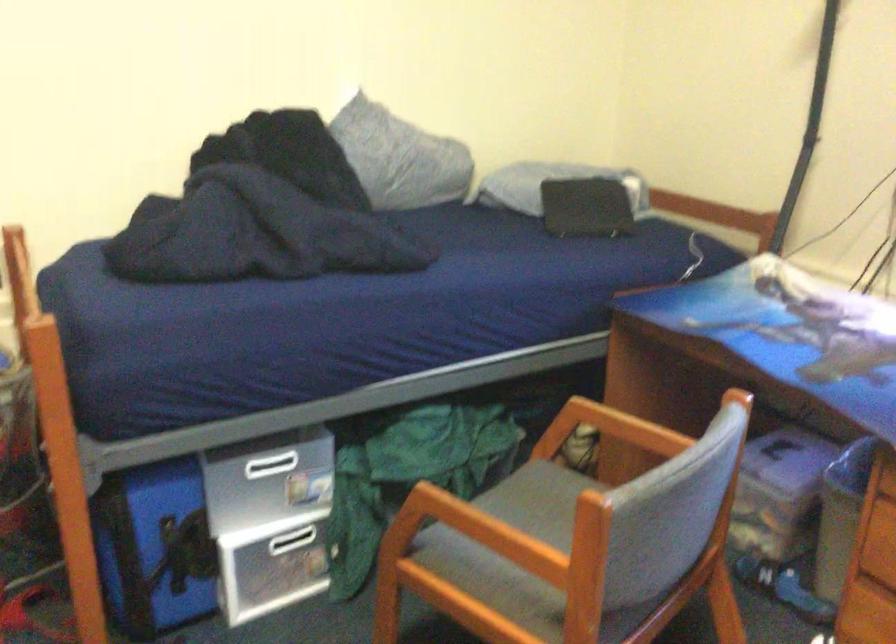
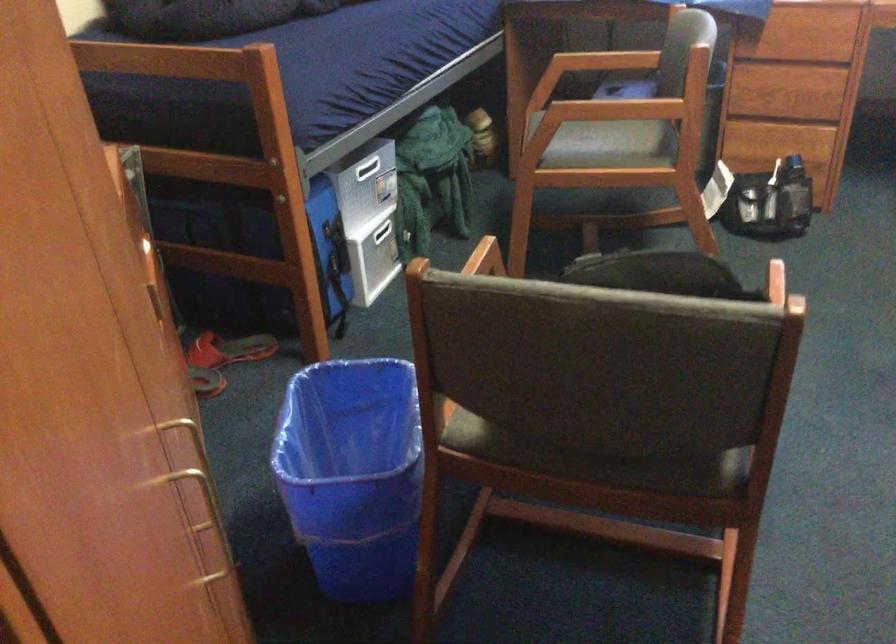
Question: I am providing you with two images of the same scene from different viewpoints. Which of the following objects are not visible in image2?

Choices:
 (A) chair sitting surface
 (B) yellow soap pump
 (C) red sandal
 (D) blue trash can

Answer: (A)